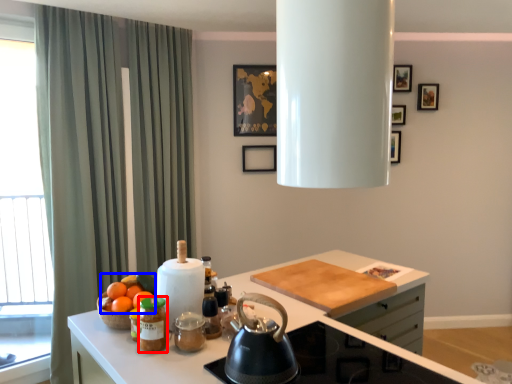
Question: Which object appears closest to the camera in this image, beverage (highlighted by a red box) or fruit (highlighted by a blue box)?

Choices:
 (A) beverage
 (B) fruit

Answer: (A)